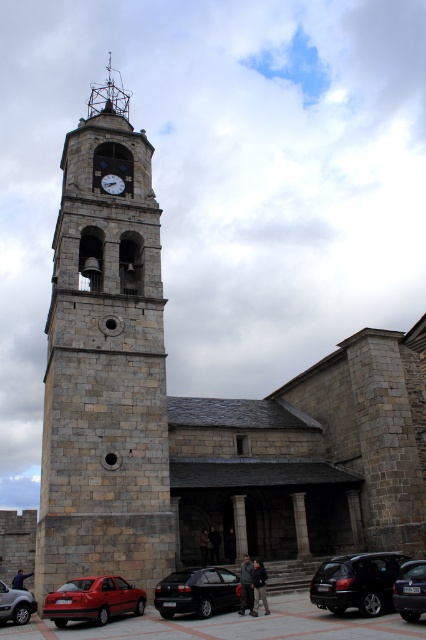
Is shiny black suv at lower right shorter than matte black sedan at lower left?

Yes, shiny black suv at lower right is shorter than matte black sedan at lower left.

Between shiny black suv at lower right and matte black sedan at lower left, which one appears on the right side from the viewer's perspective?

From the viewer's perspective, shiny black suv at lower right appears more on the right side.

Measure the distance between point (x=368, y=589) and camera.

Point (x=368, y=589) and camera are 33.49 meters apart.

The image size is (426, 640). What are the coordinates of `shiny black suv at lower right` in the screenshot? It's located at (356, 582).

In the scene shown: Is the position of matte black sedan at lower left less distant than that of matte gray clock at center?

Yes, it is.

Is matte black sedan at lower left thinner than matte gray clock at center?

No.

Locate an element on the screen. matte black sedan at lower left is located at coordinates (16, 604).

Can you confirm if stone clock tower at center is positioned above matte black sedan at lower left?

Yes, stone clock tower at center is above matte black sedan at lower left.

Which is behind, point (104, 426) or point (8, 604)?

Positioned behind is point (104, 426).

Who is more distant from viewer, (109,147) or (13,600)?

The point (109,147) is more distant.

Identify the location of stone clock tower at center. This screenshot has width=426, height=640. (104, 364).